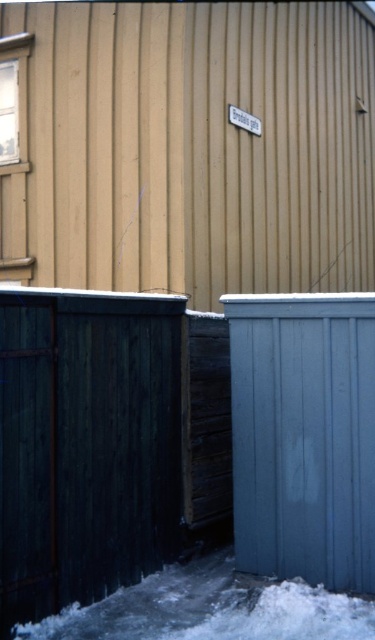
Question: Is dark green wooden fence at left closer to camera compared to blue painted wood fence at lower right?

Choices:
 (A) yes
 (B) no

Answer: (A)

Question: Which point appears farthest from the camera in this image?

Choices:
 (A) (34, 326)
 (B) (351, 627)
 (C) (361, 589)

Answer: (C)

Question: Which point is farther to the camera?

Choices:
 (A) (328, 320)
 (B) (340, 636)

Answer: (A)

Question: Observing the image, what is the correct spatial positioning of dark green wooden fence at left in reference to blue painted wood fence at lower right?

Choices:
 (A) left
 (B) right

Answer: (A)

Question: Based on their relative distances, which object is farther from the dark green wooden fence at left?

Choices:
 (A) blue painted wood fence at lower right
 (B) white powdery snow at lower center

Answer: (A)

Question: Can you confirm if blue painted wood fence at lower right is wider than white powdery snow at lower center?

Choices:
 (A) no
 (B) yes

Answer: (A)